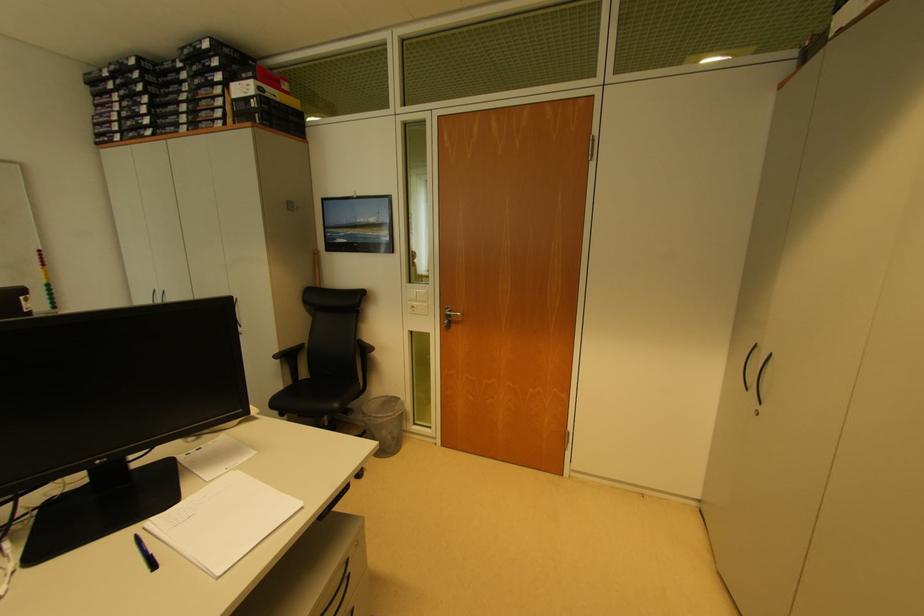
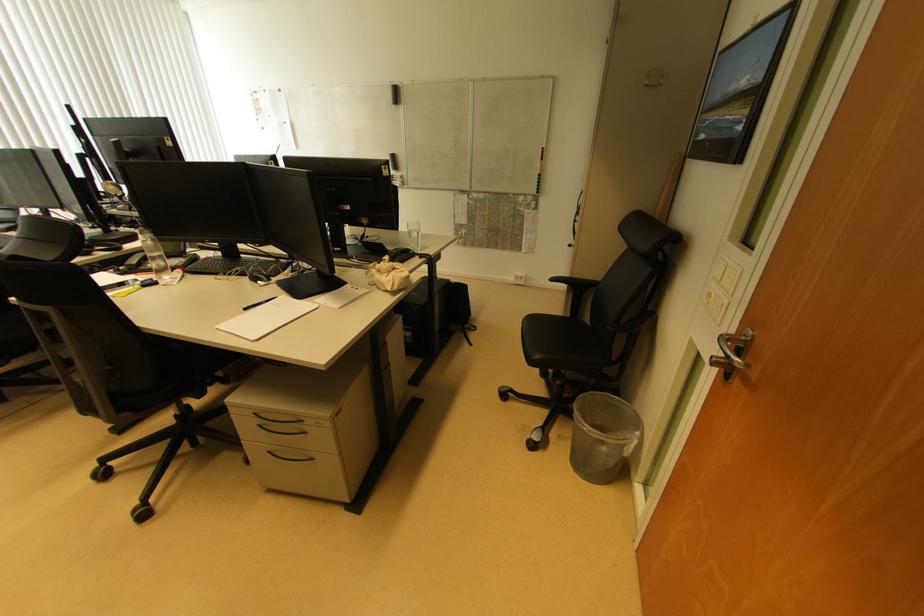
The point at (415, 310) is marked in the first image. Where is the corresponding point in the second image?

(712, 297)